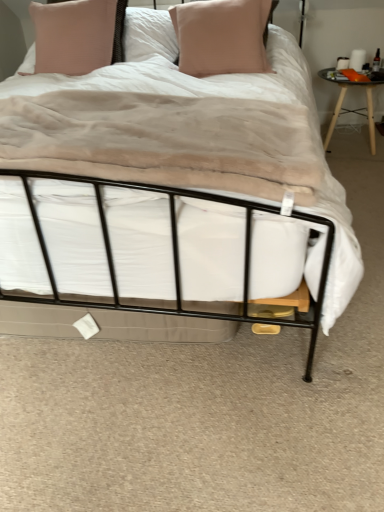
Where is `free point below black glass table at right (from a real-world perspective)`? The width and height of the screenshot is (384, 512). free point below black glass table at right (from a real-world perspective) is located at coordinates [x=347, y=147].